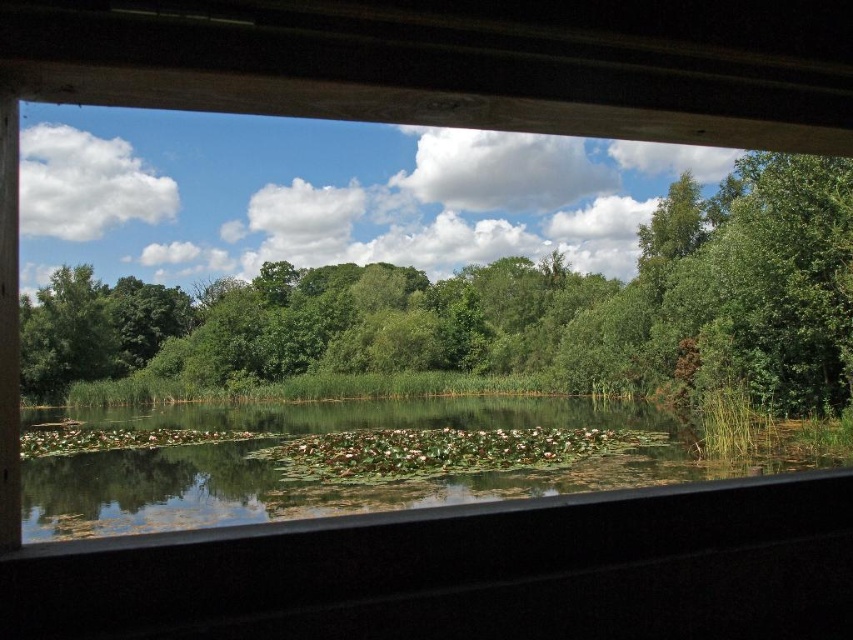
Question: Can you confirm if green leafy tree at upper center is positioned above green leafy water at center?

Choices:
 (A) yes
 (B) no

Answer: (A)

Question: Can you confirm if green leafy tree at upper center is thinner than green leafy water at center?

Choices:
 (A) yes
 (B) no

Answer: (B)

Question: Is green leafy tree at upper center further to the viewer compared to green leafy water at center?

Choices:
 (A) no
 (B) yes

Answer: (B)

Question: Which point appears closest to the camera in this image?

Choices:
 (A) coord(192,493)
 (B) coord(627,292)

Answer: (A)